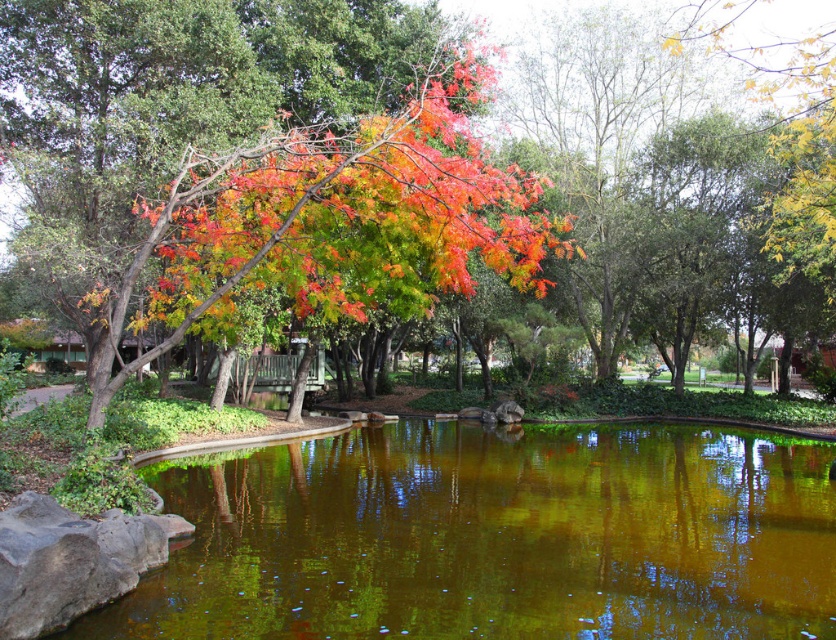
You are standing at the edge of the pond in the park. There is a point marked at coordinates (493,536) which is the green reflective water at center. Can you confirm if this point is located in the water area of the pond?

Yes, the point (493,536) marks green reflective water at center, so it is located in the water area of the pond.